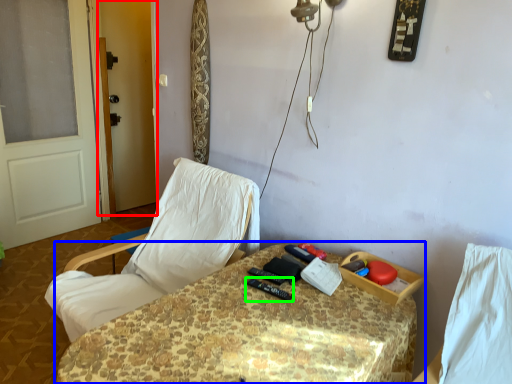
Question: Which object is the closest to the screen door (highlighted by a red box)? Choose among these: table (highlighted by a blue box) or equipment (highlighted by a green box).

Choices:
 (A) table
 (B) equipment

Answer: (A)